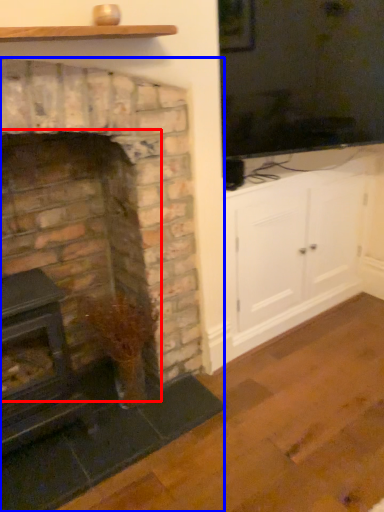
Question: Which object is further to the camera taking this photo, fireplace (highlighted by a red box) or fireplace (highlighted by a blue box)?

Choices:
 (A) fireplace
 (B) fireplace

Answer: (A)